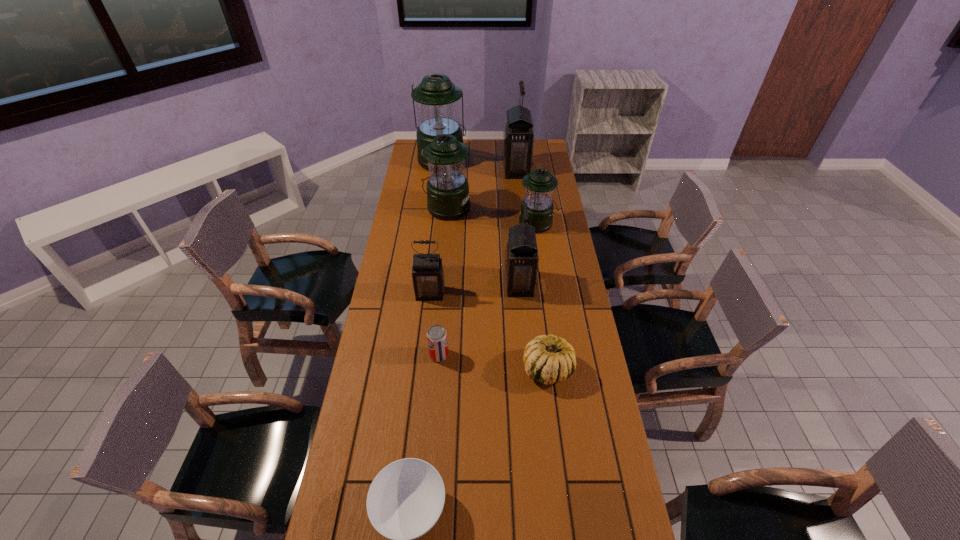
At what (x,y) coordinates should I click in order to perform the action: click on vacant space situated on the front-facing side of the farthest gray lantern. Please return your answer as a coordinate pair (x, y). The height and width of the screenshot is (540, 960). Looking at the image, I should click on (431, 170).

Find the location of a particular element. The width and height of the screenshot is (960, 540). vacant space situated on the front-facing side of the farthest gray lantern is located at coordinates [465, 170].

The height and width of the screenshot is (540, 960). I want to click on free space located on the back of the second smallest green lantern, so click(x=451, y=157).

Locate an element on the screen. This screenshot has width=960, height=540. vacant space positioned on the front-facing side of the second biggest gray lantern is located at coordinates (446, 284).

The height and width of the screenshot is (540, 960). Identify the location of vacant region located on the front-facing side of the second biggest gray lantern. (409, 284).

Locate an element on the screen. vacant space situated on the front-facing side of the second biggest gray lantern is located at coordinates (482, 284).

The width and height of the screenshot is (960, 540). I want to click on vacant area situated 0.200m on the front-facing side of the leftmost gray lantern, so point(424,345).

Identify the location of free space located 0.250m on the back of the smallest green lantern. point(532,184).

Where is `free location located 0.060m on the right of the gourd`? The width and height of the screenshot is (960, 540). free location located 0.060m on the right of the gourd is located at coordinates (591, 369).

Where is `vacant region located 0.120m on the right of the soda`? This screenshot has width=960, height=540. vacant region located 0.120m on the right of the soda is located at coordinates (484, 355).